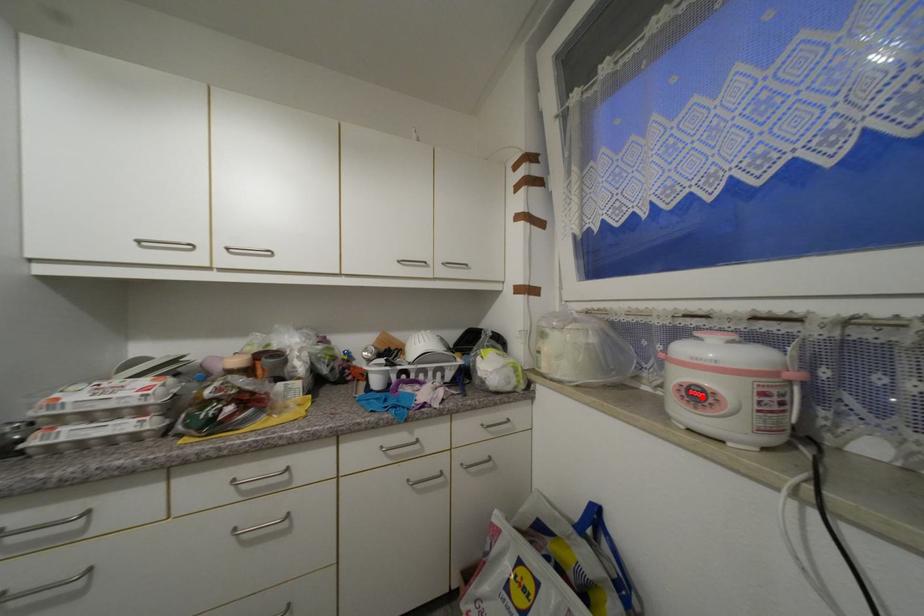
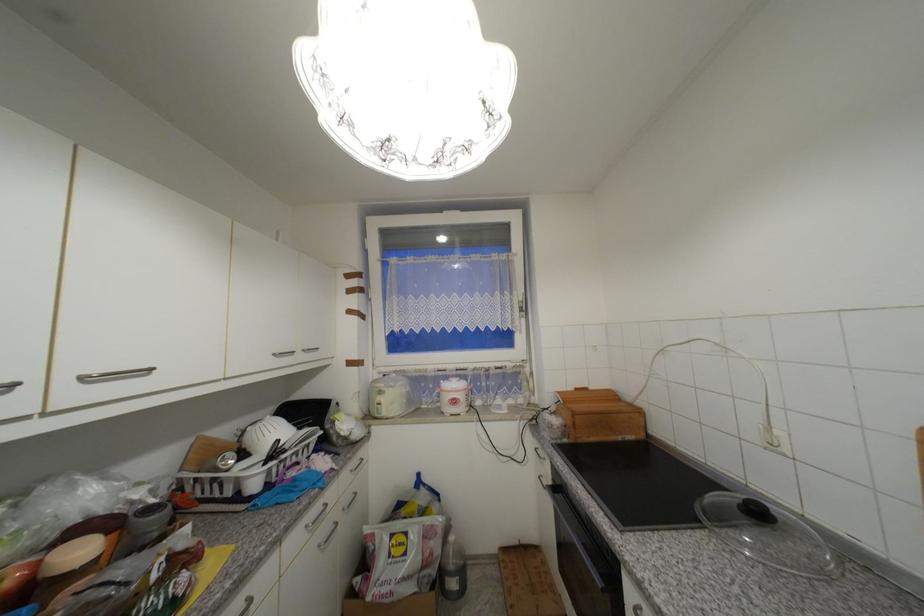
The point at the highlighted location is marked in the first image. Where is the corresponding point in the second image?

(459, 403)